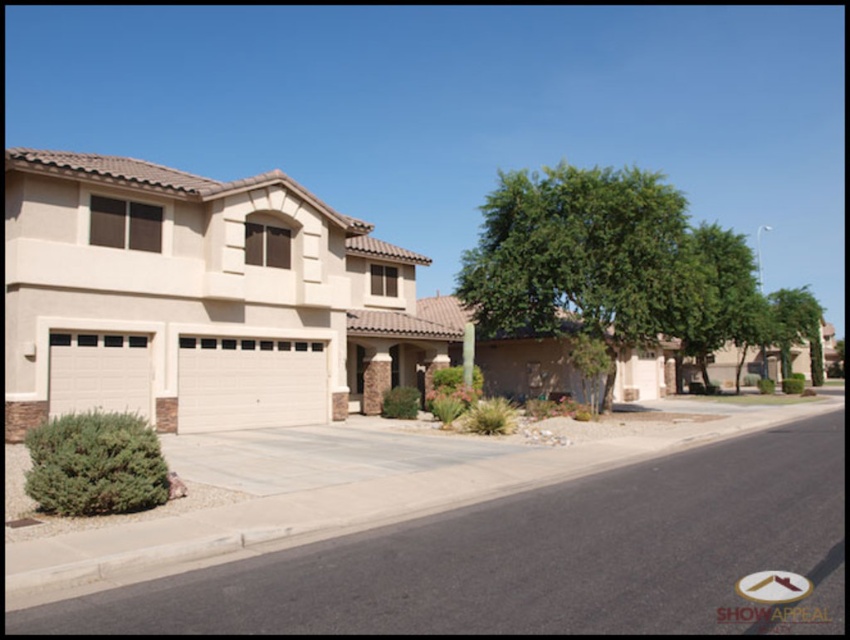
Can you confirm if gray concrete driveway at center is thinner than beige textured garage door at center?

Incorrect, gray concrete driveway at center's width is not less than beige textured garage door at center's.

Is gray concrete driveway at center below beige textured garage door at center?

Yes, gray concrete driveway at center is below beige textured garage door at center.

Is point (782, 536) positioned before point (180, 429)?

Yes, it is.

Where is `gray concrete driveway at center`? The image size is (850, 640). gray concrete driveway at center is located at coordinates (536, 557).

Is point (463, 257) positioned after point (89, 364)?

Yes, it is.

Is point (678, 296) behind point (78, 342)?

Yes, point (678, 296) is behind point (78, 342).

Find the location of a particular element. This screenshot has height=640, width=850. green leafy tree at center is located at coordinates 581,259.

Which of these two, beige textured garage at center or beige textured garage door at center, stands shorter?

Standing shorter between the two is beige textured garage door at center.

Between beige textured garage at center and beige textured garage door at center, which one is positioned higher?

beige textured garage at center is above.

The image size is (850, 640). In order to click on beige textured garage at center in this screenshot , I will do `click(191, 296)`.

The height and width of the screenshot is (640, 850). Identify the location of beige textured garage at center. (191, 296).